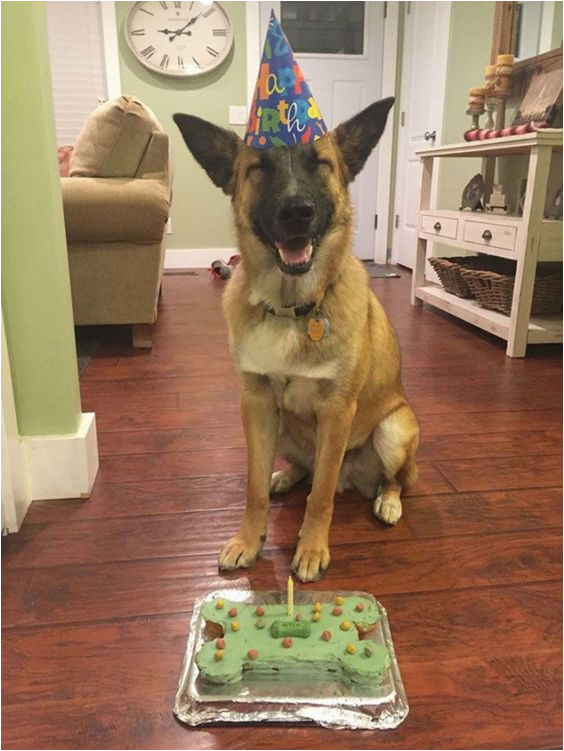
At what (x,y) coordinates should I click in order to perform the action: click on wall clock. Please return your answer as a coordinate pair (x, y). This screenshot has width=564, height=751. Looking at the image, I should click on (187, 53).